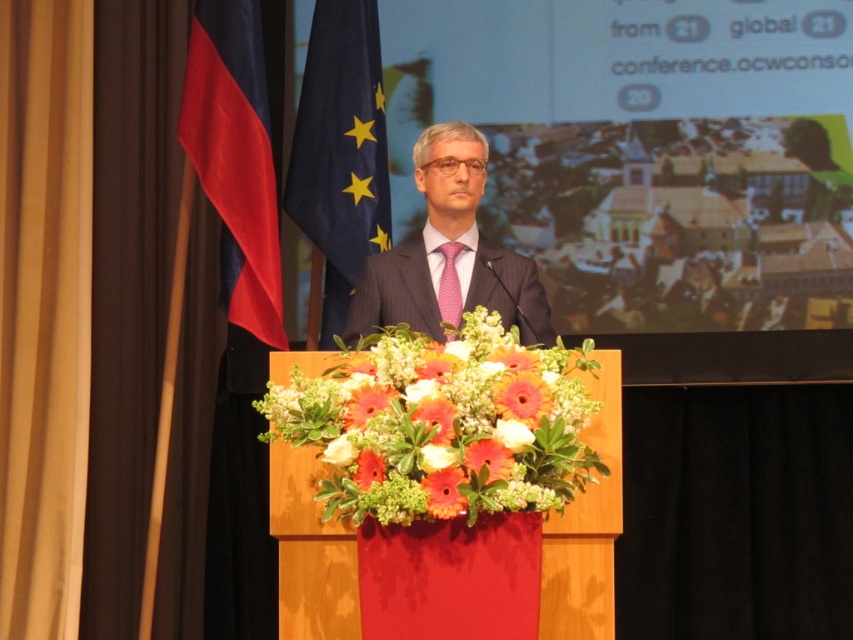
Question: Does blue fabric flag at upper left have a greater width compared to red fabric flag at left?

Choices:
 (A) no
 (B) yes

Answer: (B)

Question: Considering the real-world distances, which object is farthest from the vibrant orange petals at center?

Choices:
 (A) pink dotted fabric tie at center
 (B) red fabric flag at left
 (C) matte black suit at center
 (D) orange matte flower at center

Answer: (B)

Question: Can you confirm if red fabric flag at left is positioned above matte black suit at center?

Choices:
 (A) yes
 (B) no

Answer: (A)

Question: Observing the image, what is the correct spatial positioning of blue fabric flag at upper left in reference to orange matte flower at center?

Choices:
 (A) right
 (B) left

Answer: (B)

Question: Among these objects, which one is farthest from the camera?

Choices:
 (A) pink dotted fabric tie at center
 (B) vibrant orange petals at center
 (C) red fabric flag at left
 (D) blue fabric flag at upper left

Answer: (D)

Question: Which point is closer to the camera taking this photo?

Choices:
 (A) (498, 465)
 (B) (445, 268)
 (C) (491, 321)
 (D) (233, 188)

Answer: (A)